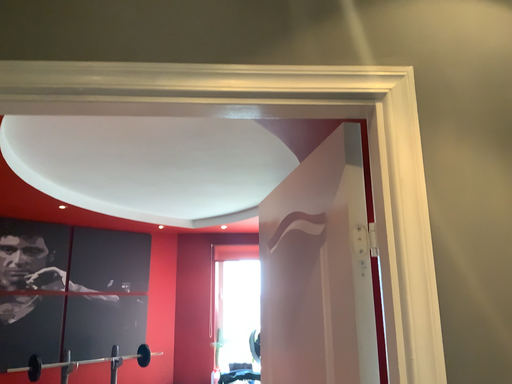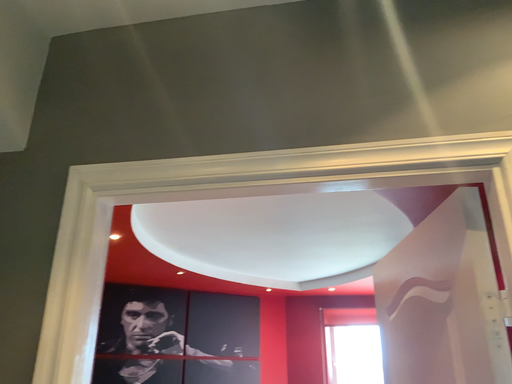
Question: Which way did the camera rotate in the video?

Choices:
 (A) rotated upward
 (B) rotated downward

Answer: (A)